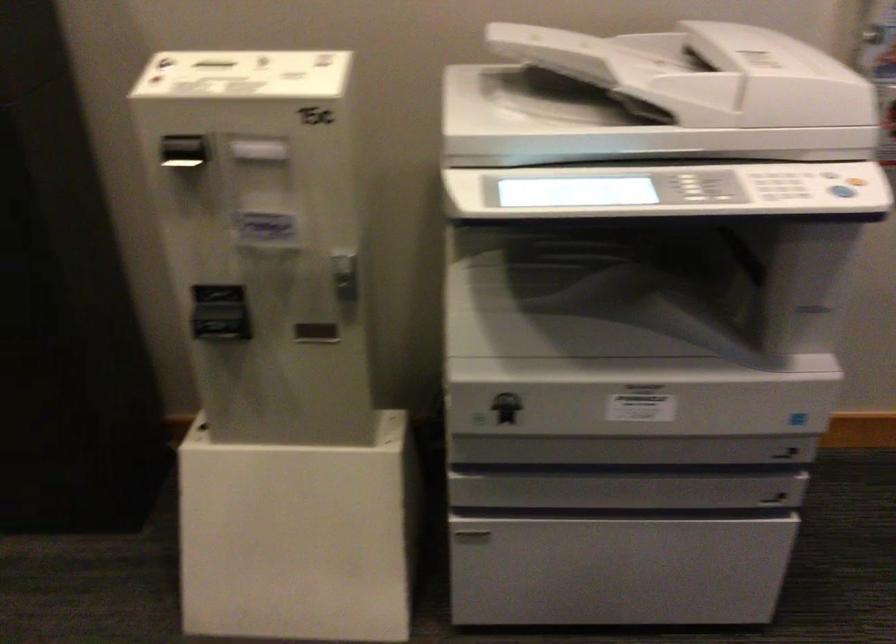
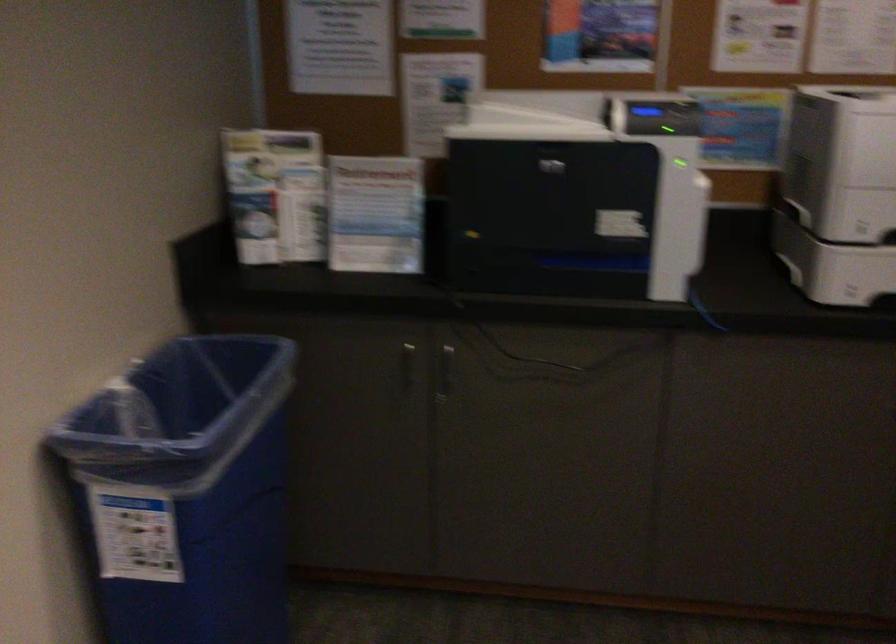
The images are taken continuously from a first-person perspective. In which direction is your viewpoint rotating?

The camera rotated toward left-down.